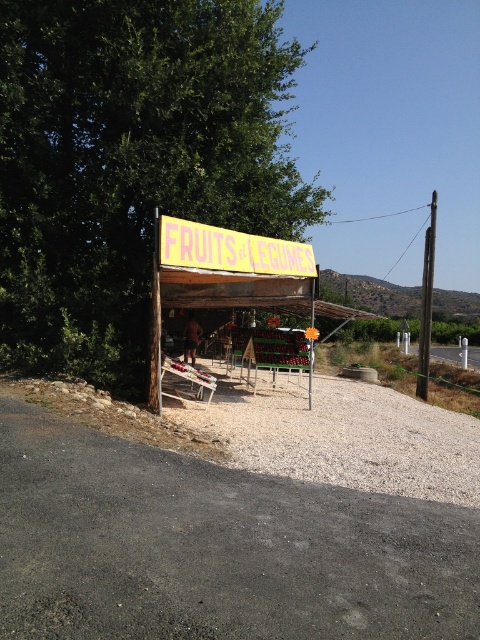
Question: Which is farther from the brown wooden pole at right?

Choices:
 (A) green leafy tree at upper left
 (B) gray gravel at lower center
 (C) gray gravel road at lower left

Answer: (C)

Question: Does gray gravel at lower center have a lesser width compared to brown wooden pole at right?

Choices:
 (A) no
 (B) yes

Answer: (B)

Question: Based on their relative distances, which object is nearer to the brown wooden pole at right?

Choices:
 (A) green leafy tree at upper left
 (B) gray gravel road at lower left
 (C) gray gravel at lower center

Answer: (C)

Question: Which of the following is the farthest from the observer?

Choices:
 (A) gray gravel at lower center
 (B) brown wooden pole at right

Answer: (B)

Question: Can you confirm if green leafy tree at upper left is wider than brown wooden pole at right?

Choices:
 (A) no
 (B) yes

Answer: (A)

Question: Is gray gravel at lower center further to the viewer compared to brown wooden pole at right?

Choices:
 (A) yes
 (B) no

Answer: (B)